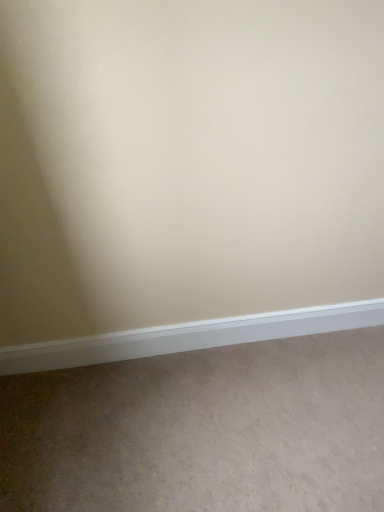
What do you see at coordinates (202, 430) in the screenshot?
I see `beige carpet at lower center` at bounding box center [202, 430].

Identify the location of beige carpet at lower center. (202, 430).

Image resolution: width=384 pixels, height=512 pixels. Identify the location of white smooth baseboard at lower center. (188, 337).

In order to face white smooth baseboard at lower center, should I rotate leftwards or rightwards?

Rotate right and turn 1.630 degrees.

What do you see at coordinates (188, 337) in the screenshot? I see `white smooth baseboard at lower center` at bounding box center [188, 337].

Locate an element on the screen. The width and height of the screenshot is (384, 512). beige carpet at lower center is located at coordinates (202, 430).

Is beige carpet at lower center to the left or to the right of white smooth baseboard at lower center in the image?

Clearly, beige carpet at lower center is on the right of white smooth baseboard at lower center in the image.

Looking at this image, is beige carpet at lower center closer to camera compared to white smooth baseboard at lower center?

Yes, it is.

Is point (283, 362) behind point (208, 342)?

That is False.

From the image's perspective, is beige carpet at lower center beneath white smooth baseboard at lower center?

Yes, from the image's perspective, beige carpet at lower center is below white smooth baseboard at lower center.

From a real-world perspective, is beige carpet at lower center positioned under white smooth baseboard at lower center based on gravity?

Yes, from a real-world perspective, beige carpet at lower center is below white smooth baseboard at lower center.

Is beige carpet at lower center wider than white smooth baseboard at lower center?

Yes, beige carpet at lower center is wider than white smooth baseboard at lower center.

Which of these two, beige carpet at lower center or white smooth baseboard at lower center, stands taller?

With more height is white smooth baseboard at lower center.

Does beige carpet at lower center have a smaller size compared to white smooth baseboard at lower center?

Incorrect, beige carpet at lower center is not smaller in size than white smooth baseboard at lower center.

In the scene shown: Does beige carpet at lower center contain white smooth baseboard at lower center?

No.

Is beige carpet at lower center far away from white smooth baseboard at lower center?

No, there isn't a large distance between beige carpet at lower center and white smooth baseboard at lower center.

Is beige carpet at lower center turned away from white smooth baseboard at lower center?

That's not correct — beige carpet at lower center is not looking away from white smooth baseboard at lower center.

Based on the photo, how much distance is there between beige carpet at lower center and white smooth baseboard at lower center?

beige carpet at lower center is 27.03 centimeters from white smooth baseboard at lower center.

Locate an element on the screen. This screenshot has height=512, width=384. plain that appears in front of the white smooth baseboard at lower center is located at coordinates (202, 430).

Is white smooth baseboard at lower center at the right side of beige carpet at lower center?

Incorrect, white smooth baseboard at lower center is not on the right side of beige carpet at lower center.

Between white smooth baseboard at lower center and beige carpet at lower center, which one is positioned in front?

beige carpet at lower center is more forward.

Is point (85, 342) positioned before point (369, 434)?

No, (85, 342) is further to viewer.

From the image's perspective, is white smooth baseboard at lower center beneath beige carpet at lower center?

Actually, white smooth baseboard at lower center appears above beige carpet at lower center in the image.

From a real-world perspective, which is physically below, white smooth baseboard at lower center or beige carpet at lower center?

beige carpet at lower center.

Which object is thinner, white smooth baseboard at lower center or beige carpet at lower center?

white smooth baseboard at lower center is thinner.

Considering the sizes of objects white smooth baseboard at lower center and beige carpet at lower center in the image provided, who is shorter, white smooth baseboard at lower center or beige carpet at lower center?

beige carpet at lower center.

Considering the sizes of objects white smooth baseboard at lower center and beige carpet at lower center in the image provided, who is smaller, white smooth baseboard at lower center or beige carpet at lower center?

white smooth baseboard at lower center is smaller.

Is white smooth baseboard at lower center inside the boundaries of beige carpet at lower center, or outside?

white smooth baseboard at lower center is spatially situated outside beige carpet at lower center.

Is white smooth baseboard at lower center not close to beige carpet at lower center?

No.

Is white smooth baseboard at lower center oriented towards beige carpet at lower center?

Yes, white smooth baseboard at lower center is aimed at beige carpet at lower center.

Measure the distance between white smooth baseboard at lower center and beige carpet at lower center.

white smooth baseboard at lower center is 10.64 inches from beige carpet at lower center.

Image resolution: width=384 pixels, height=512 pixels. I want to click on window sill lying on the left of beige carpet at lower center, so click(188, 337).

This screenshot has width=384, height=512. Find the location of `window sill above the beige carpet at lower center (from a real-world perspective)`. window sill above the beige carpet at lower center (from a real-world perspective) is located at coordinates (188, 337).

The image size is (384, 512). I want to click on plain in front of the white smooth baseboard at lower center, so click(202, 430).